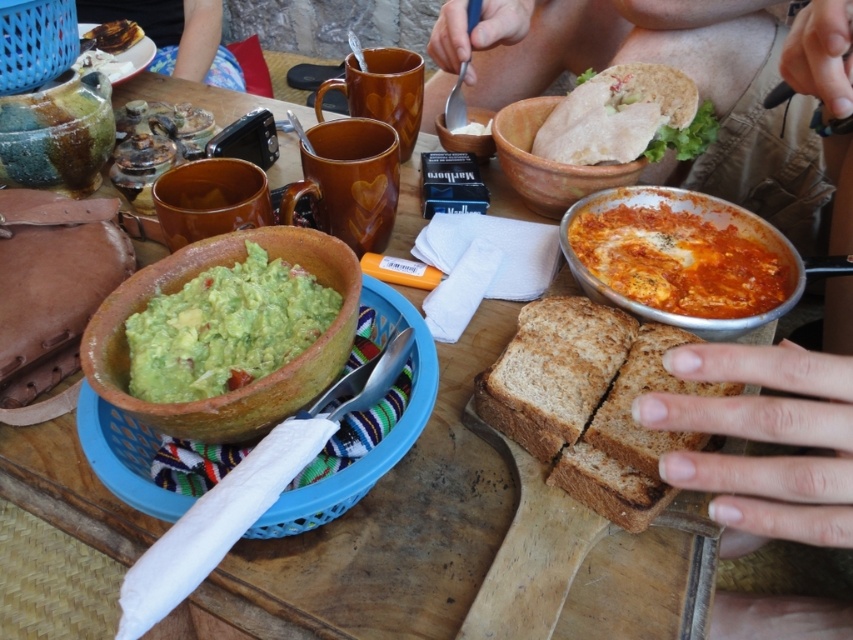
Question: Does tomato-based sauce at center have a smaller size compared to green matte guacamole at center?

Choices:
 (A) no
 (B) yes

Answer: (A)

Question: Estimate the real-world distances between objects in this image. Which object is farther from the matte brown bread at upper right?

Choices:
 (A) brown matte bread at center
 (B) matte clay bowl at center

Answer: (A)

Question: Is skinny beige shorts at upper center bigger than brown matte bread at center?

Choices:
 (A) yes
 (B) no

Answer: (A)

Question: Does matte brown bread at upper right have a lesser width compared to shiny chocolate bar at upper left?

Choices:
 (A) no
 (B) yes

Answer: (A)

Question: Which point appears farthest from the camera in this image?

Choices:
 (A) (577, 397)
 (B) (535, 161)

Answer: (B)

Question: Which of the following is the farthest from the observer?

Choices:
 (A) matte clay bowl at center
 (B) matte brown bread at upper right
 (C) green matte guacamole at center
 (D) skinny beige shorts at upper center

Answer: (B)